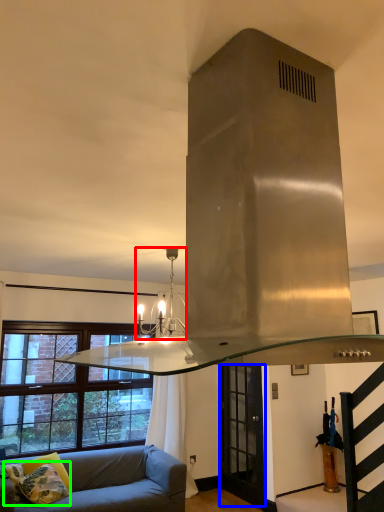
Question: Based on their relative distances, which object is farther from light fixture (highlighted by a red box)? Choose from glass door (highlighted by a blue box) and pillow (highlighted by a green box).

Choices:
 (A) glass door
 (B) pillow

Answer: (A)